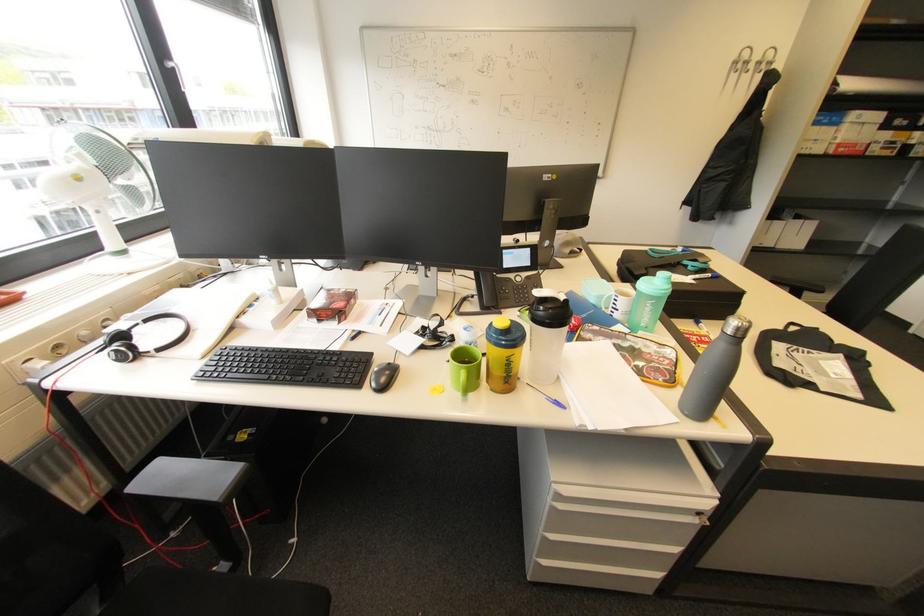
Locate an element on the screen. The height and width of the screenshot is (616, 924). black computer mouse is located at coordinates (383, 377).